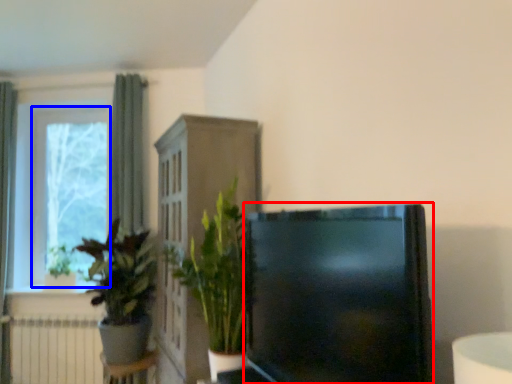
Question: Which object appears closest to the camera in this image, television (highlighted by a red box) or window frame (highlighted by a blue box)?

Choices:
 (A) television
 (B) window frame

Answer: (A)